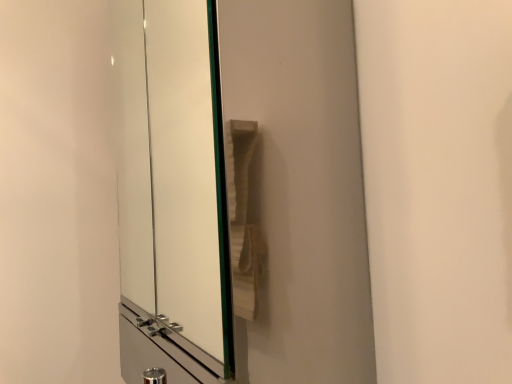
Question: Should I look upward or downward to see clear glass door at center?

Choices:
 (A) down
 (B) up

Answer: (B)